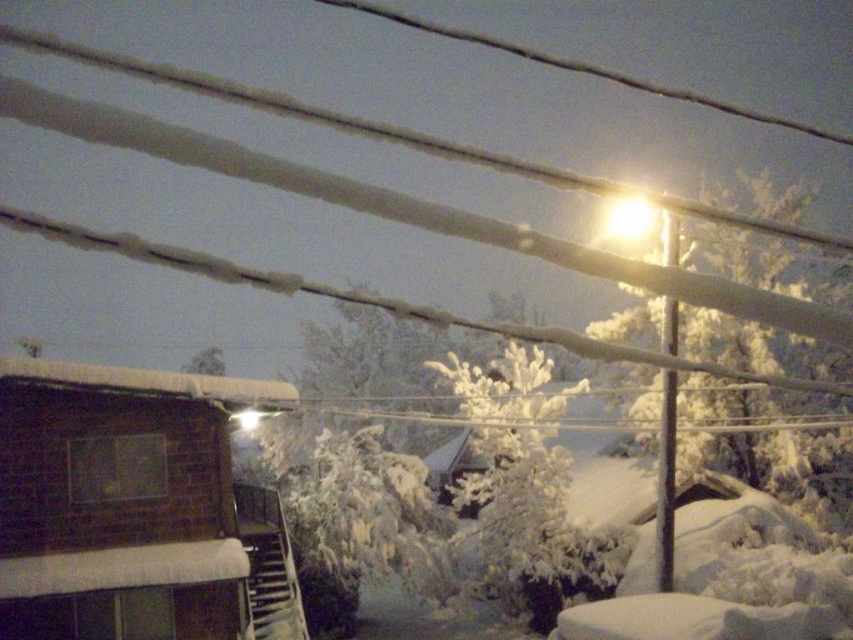
Question: Is white frosty tree at center to the right of white frosty tree at upper right from the viewer's perspective?

Choices:
 (A) no
 (B) yes

Answer: (A)

Question: Can you confirm if white frosty tree at center is bigger than white frosty tree at upper right?

Choices:
 (A) yes
 (B) no

Answer: (B)

Question: Among these objects, which one is nearest to the camera?

Choices:
 (A) white frosty tree at upper right
 (B) white frosty tree at center

Answer: (B)

Question: Is white frosty tree at center behind white frosty tree at upper right?

Choices:
 (A) yes
 (B) no

Answer: (B)

Question: Which point is farther to the camera?

Choices:
 (A) white frosty tree at center
 (B) white frosty tree at upper right

Answer: (B)